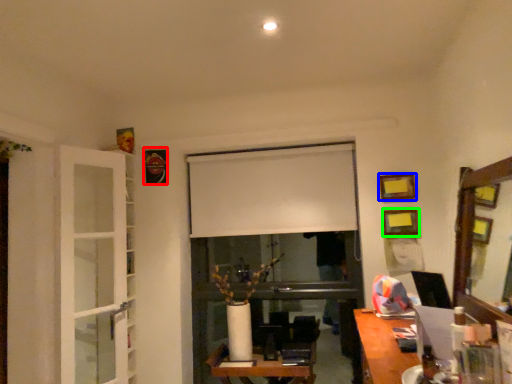
Question: Which is farther away from picture frame (highlighted by a red box)? picture frame (highlighted by a blue box) or picture frame (highlighted by a green box)?

Choices:
 (A) picture frame
 (B) picture frame

Answer: (B)